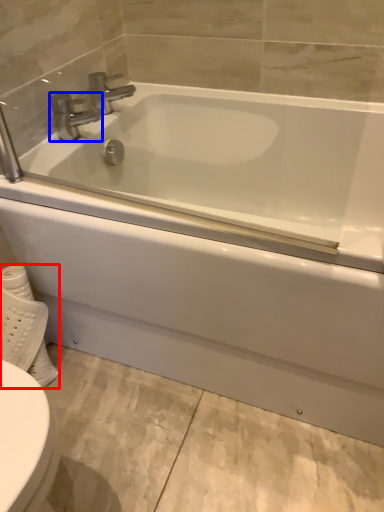
Question: Which object is further to the camera taking this photo, toilet paper (highlighted by a red box) or tap (highlighted by a blue box)?

Choices:
 (A) toilet paper
 (B) tap

Answer: (B)